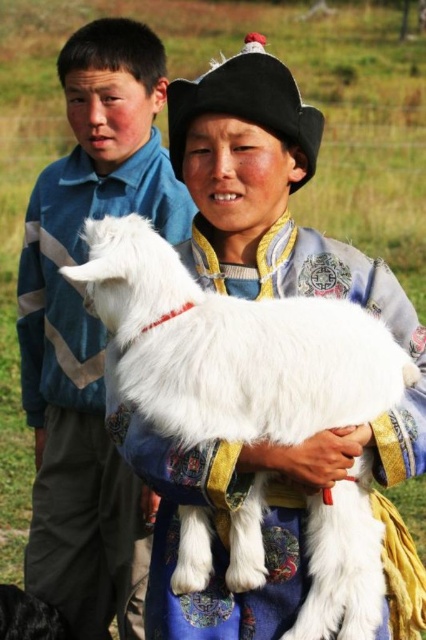
Between fluffy white lamb at center and matte blue shirt at center, which one appears on the left side from the viewer's perspective?

matte blue shirt at center is more to the left.

How much distance is there between fluffy white lamb at center and matte blue shirt at center?

fluffy white lamb at center is 6.69 feet from matte blue shirt at center.

Where is `fluffy white lamb at center`? This screenshot has height=640, width=426. fluffy white lamb at center is located at coordinates (233, 348).

Where is `fluffy white lamb at center`? fluffy white lamb at center is located at coordinates (233, 348).